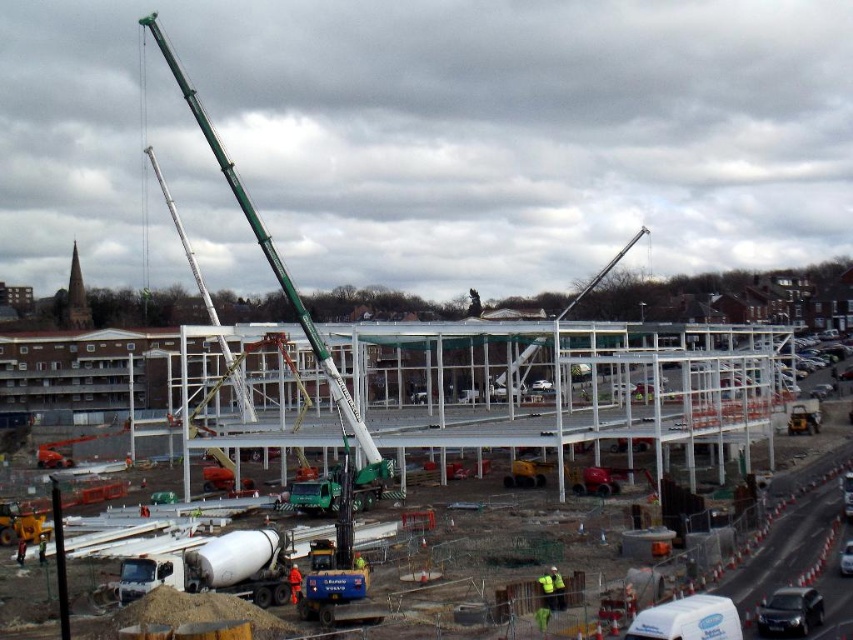
Question: Which point is farther from the camera taking this photo?

Choices:
 (A) (701, 618)
 (B) (521, 362)

Answer: (B)

Question: In this image, where is white metallic framework at center located relative to green metallic crane at center?

Choices:
 (A) right
 (B) left

Answer: (A)

Question: Which of the following is the closest to the observer?

Choices:
 (A) white glossy van at lower right
 (B) white metallic framework at center
 (C) metallic silver crane at center
 (D) green metallic crane at center

Answer: (A)

Question: Which of these objects is positioned closest to the white metallic framework at center?

Choices:
 (A) metallic silver crane at center
 (B) white glossy van at lower right
 (C) green metallic crane at center

Answer: (A)

Question: Does white glossy van at lower right have a smaller size compared to metallic silver crane at center?

Choices:
 (A) yes
 (B) no

Answer: (A)

Question: Is white metallic framework at center closer to the viewer compared to white glossy van at lower right?

Choices:
 (A) no
 (B) yes

Answer: (A)